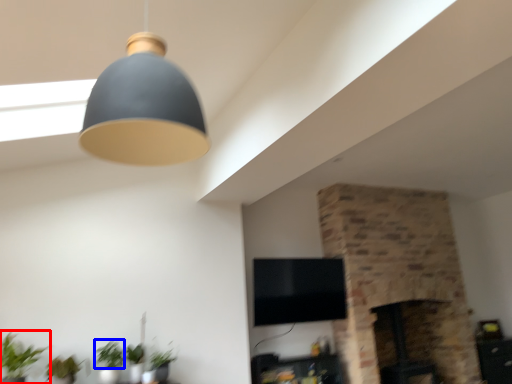
Question: Which object is further to the camera taking this photo, houseplant (highlighted by a red box) or plant (highlighted by a blue box)?

Choices:
 (A) houseplant
 (B) plant

Answer: (B)